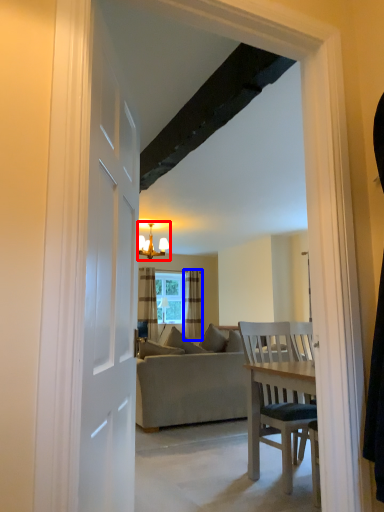
Question: Among these objects, which one is farthest to the camera, light fixture (highlighted by a red box) or curtain (highlighted by a blue box)?

Choices:
 (A) light fixture
 (B) curtain

Answer: (B)